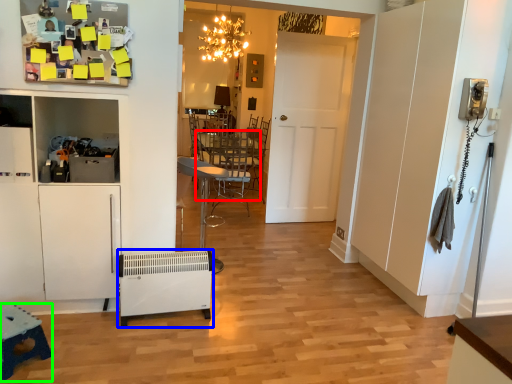
Question: Which object is the closest to the table (highlighted by a red box)? Choose among these: appliance (highlighted by a blue box) or table (highlighted by a green box).

Choices:
 (A) appliance
 (B) table

Answer: (A)